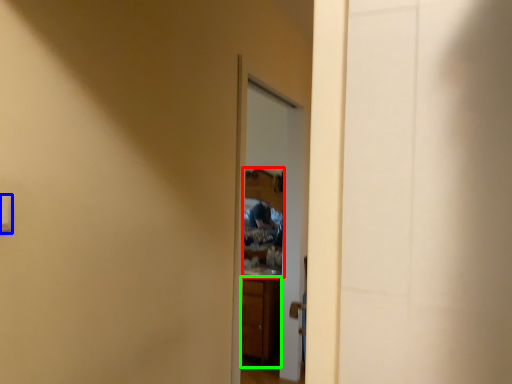
Question: Considering the real-world distances, which object is closest to mirror (highlighted by a red box)? light switch (highlighted by a blue box) or cabinetry (highlighted by a green box).

Choices:
 (A) light switch
 (B) cabinetry

Answer: (B)